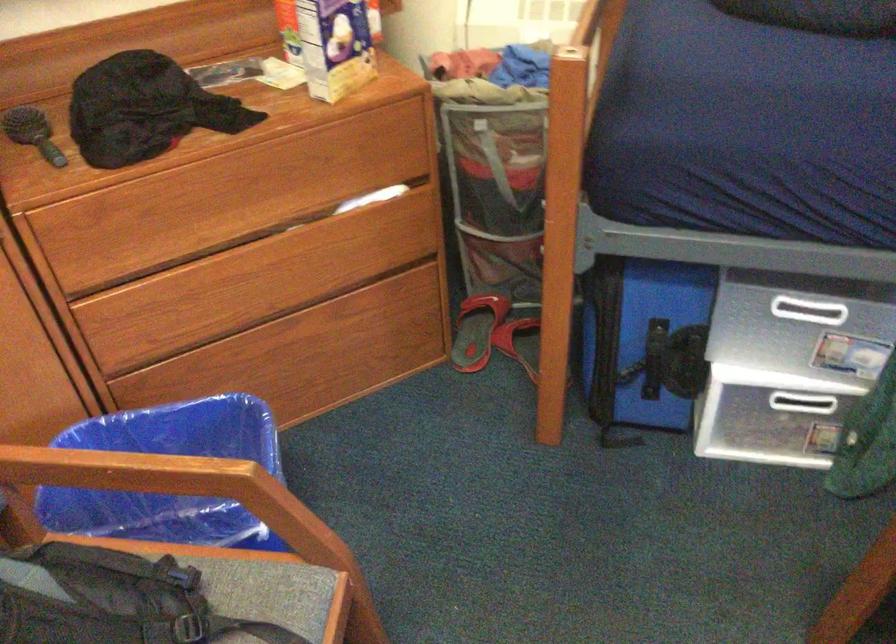
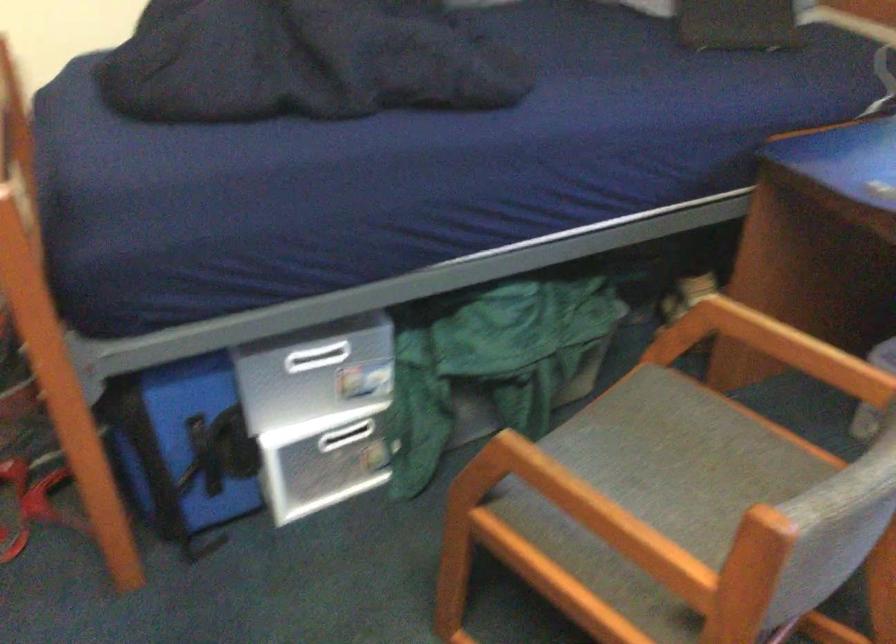
Where in the second image is the point corresponding to point (817, 308) from the first image?

(326, 355)